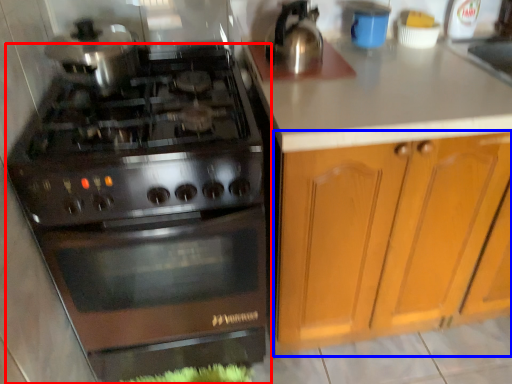
Question: Which object appears farthest to the camera in this image, gas stove (highlighted by a red box) or cabinetry (highlighted by a blue box)?

Choices:
 (A) gas stove
 (B) cabinetry

Answer: (B)